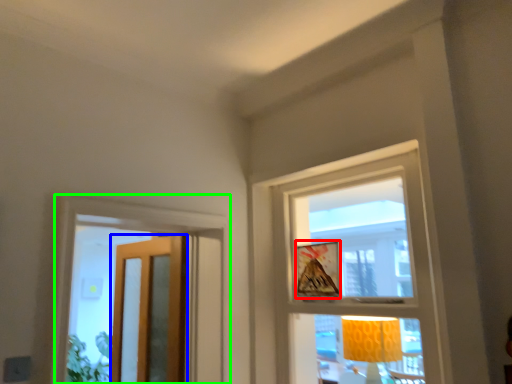
Question: Estimate the real-world distances between objects in this image. Which object is farther from picture frame (highlighted by a red box), door (highlighted by a blue box) or window (highlighted by a green box)?

Choices:
 (A) door
 (B) window

Answer: (A)